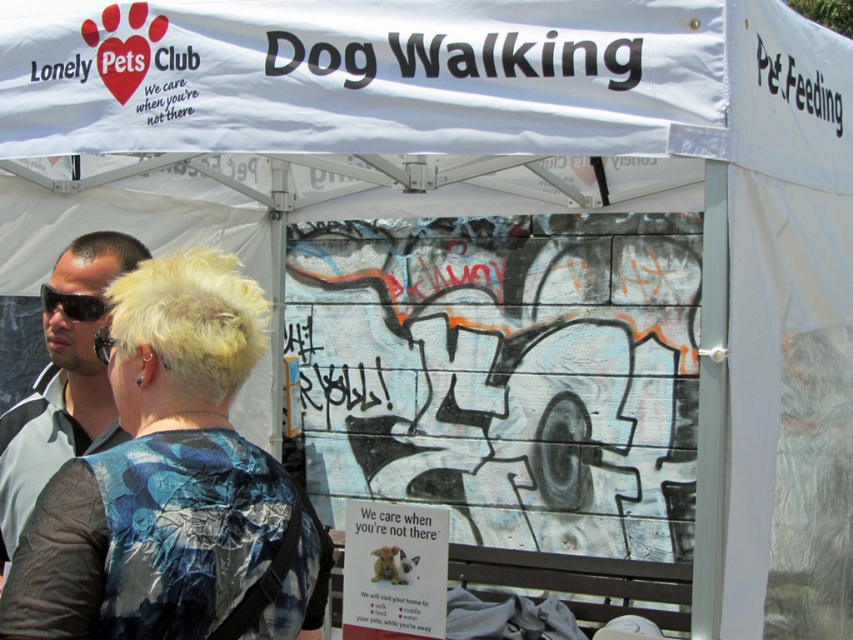
You are organizing an event and want to place a new sign under the canopy. You have a small sign that needs to fit where the black paper sign at upper center is currently located. Can the new sign be placed there if it is the same size as the black plastic sign at upper right?

The black paper sign at upper center occupies less space than the black plastic sign at upper right. If the new sign is the same size as the black plastic sign at upper right, it may not fit in the space currently occupied by the black paper sign at upper center since it is larger.

You are a customer at the event and want to know which item is bigger between the gray fabric shirt at left and the black paper sign at upper center. Can you help?

The gray fabric shirt at left is larger in size than the black paper sign at upper center.